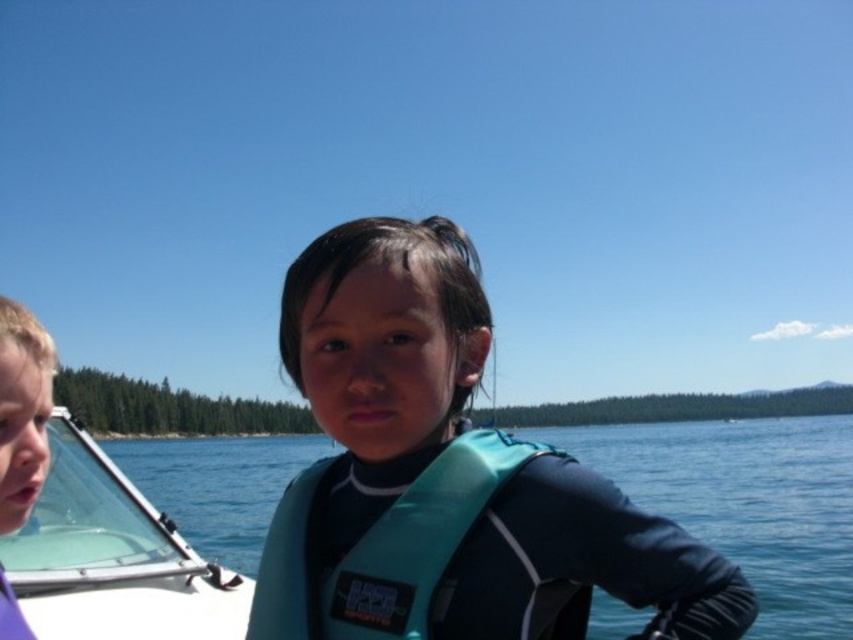
Question: Which of the following is the farthest from the observer?

Choices:
 (A) (688, 480)
 (B) (399, 528)
 (C) (38, 468)
 (D) (67, 625)

Answer: (A)

Question: Can you confirm if teal fabric life jacket at center is bigger than matte purple shirt at left?

Choices:
 (A) yes
 (B) no

Answer: (B)

Question: Which object is the farthest from the transparent plastic boat at lower left?

Choices:
 (A) teal fabric life jacket at center
 (B) teal life vest at center
 (C) teal fabric life vest at center

Answer: (B)

Question: Is teal fabric life vest at center behind transparent plastic boat at lower left?

Choices:
 (A) no
 (B) yes

Answer: (A)

Question: Observing the image, what is the correct spatial positioning of teal fabric life vest at center in reference to teal fabric life jacket at center?

Choices:
 (A) left
 (B) right

Answer: (B)

Question: Which point appears farthest from the camera in this image?

Choices:
 (A) (9, 346)
 (B) (62, 592)
 (C) (100, 499)
 (D) (503, 554)

Answer: (C)